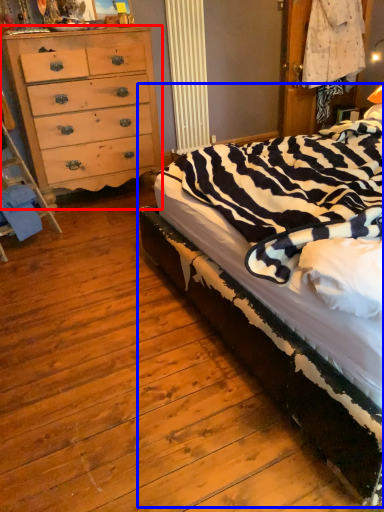
Question: Which object appears closest to the camera in this image, chest of drawers (highlighted by a red box) or bed (highlighted by a blue box)?

Choices:
 (A) chest of drawers
 (B) bed

Answer: (B)